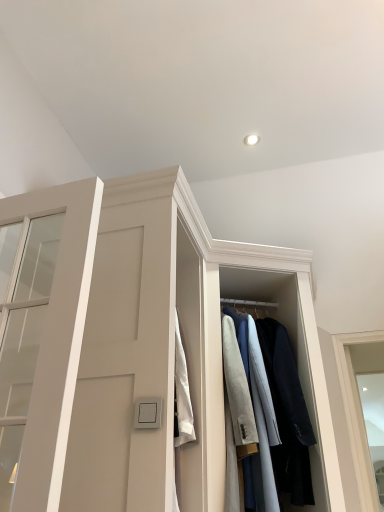
Question: Does white matte door at left have a greater width compared to light gray wool coat at center?

Choices:
 (A) no
 (B) yes

Answer: (A)

Question: Considering the relative positions of white matte door at left and light gray wool coat at center in the image provided, is white matte door at left to the right of light gray wool coat at center from the viewer's perspective?

Choices:
 (A) yes
 (B) no

Answer: (B)

Question: Is white matte door at left closer to the viewer compared to light gray wool coat at center?

Choices:
 (A) no
 (B) yes

Answer: (B)

Question: Does white matte door at left have a lesser height compared to light gray wool coat at center?

Choices:
 (A) no
 (B) yes

Answer: (B)

Question: Does white matte door at left have a lesser width compared to light gray wool coat at center?

Choices:
 (A) yes
 (B) no

Answer: (A)

Question: Is white matte door at left not close to light gray wool coat at center?

Choices:
 (A) yes
 (B) no

Answer: (A)

Question: Is light gray wool coat at center looking in the opposite direction of white matte door at left?

Choices:
 (A) no
 (B) yes

Answer: (A)

Question: Can you confirm if light gray wool coat at center is taller than white matte door at left?

Choices:
 (A) yes
 (B) no

Answer: (A)

Question: Can you confirm if light gray wool coat at center is shorter than white matte door at left?

Choices:
 (A) yes
 (B) no

Answer: (B)

Question: Does light gray wool coat at center come behind white matte door at left?

Choices:
 (A) no
 (B) yes

Answer: (B)

Question: Is light gray wool coat at center placed right next to white matte door at left?

Choices:
 (A) no
 (B) yes

Answer: (A)

Question: Does light gray wool coat at center have a lesser width compared to white matte door at left?

Choices:
 (A) no
 (B) yes

Answer: (A)

Question: Is white matte door at left wider or thinner than light gray wool coat at center?

Choices:
 (A) wide
 (B) thin

Answer: (B)